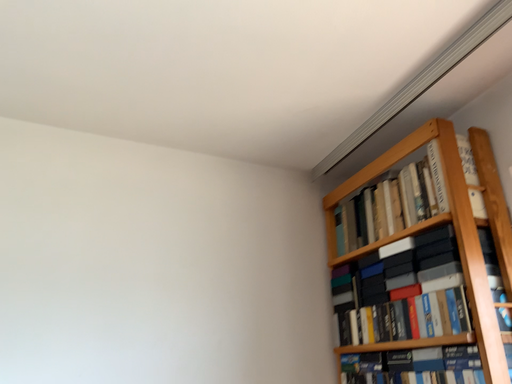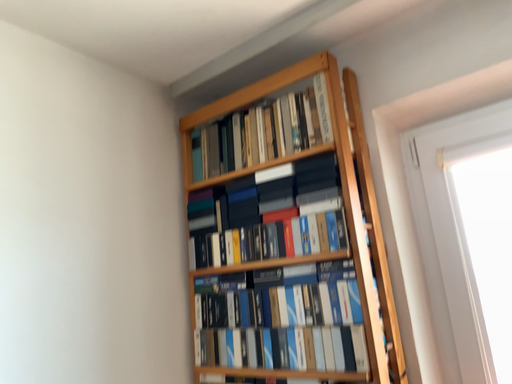
Question: How did the camera likely rotate when shooting the video?

Choices:
 (A) rotated right
 (B) rotated left

Answer: (A)